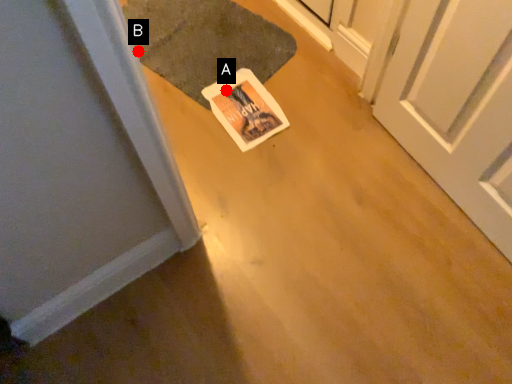
Question: Two points are circled on the image, labeled by A and B beside each circle. Which point is farther to the camera?

Choices:
 (A) A is further
 (B) B is further

Answer: (B)